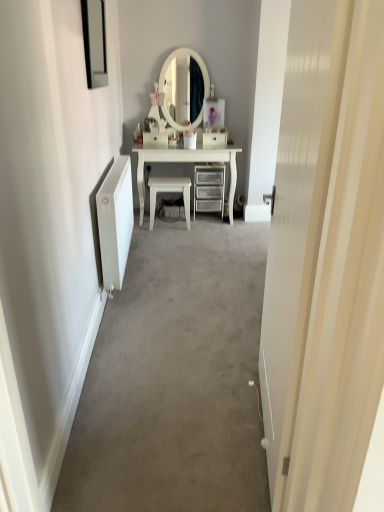
Question: Does white glossy chair at center have a lesser height compared to white glossy drawer at center, acting as the second drawer starting from the right?

Choices:
 (A) yes
 (B) no

Answer: (B)

Question: From the image's perspective, is white glossy chair at center beneath white glossy drawer at center, acting as the second drawer starting from the right?

Choices:
 (A) yes
 (B) no

Answer: (A)

Question: Does white glossy chair at center have a lesser width compared to white glossy drawer at center, acting as the second drawer starting from the right?

Choices:
 (A) no
 (B) yes

Answer: (A)

Question: Can you confirm if white glossy chair at center is smaller than white glossy drawer at center, the 1th drawer viewed from the left?

Choices:
 (A) no
 (B) yes

Answer: (A)

Question: From the image's perspective, is white glossy chair at center over white glossy drawer at center, acting as the second drawer starting from the right?

Choices:
 (A) yes
 (B) no

Answer: (B)

Question: Is white glossy chair at center positioned before white glossy drawer at center, the 1th drawer viewed from the left?

Choices:
 (A) yes
 (B) no

Answer: (A)

Question: Considering the relative sizes of white glossy drawer at center, which appears as the first drawer when viewed from the right, and white wood door at center in the image provided, is white glossy drawer at center, which appears as the first drawer when viewed from the right, shorter than white wood door at center?

Choices:
 (A) no
 (B) yes

Answer: (B)

Question: Considering the relative positions of white glossy drawer at center, the 2th drawer viewed from the left, and white wood door at center in the image provided, is white glossy drawer at center, the 2th drawer viewed from the left, to the left of white wood door at center from the viewer's perspective?

Choices:
 (A) yes
 (B) no

Answer: (A)

Question: Can you confirm if white glossy drawer at center, which appears as the first drawer when viewed from the right, is positioned to the right of white wood door at center?

Choices:
 (A) no
 (B) yes

Answer: (A)

Question: From the image's perspective, does white glossy drawer at center, which appears as the first drawer when viewed from the right, appear higher than white wood door at center?

Choices:
 (A) no
 (B) yes

Answer: (B)

Question: From the image's perspective, is white glossy drawer at center, the 2th drawer viewed from the left, located beneath white wood door at center?

Choices:
 (A) no
 (B) yes

Answer: (A)

Question: From a real-world perspective, is white glossy drawer at center, which appears as the first drawer when viewed from the right, positioned under white wood door at center based on gravity?

Choices:
 (A) no
 (B) yes

Answer: (B)

Question: Does white glossy chair at center appear on the left side of metallic silver chest of drawers at center?

Choices:
 (A) no
 (B) yes

Answer: (B)